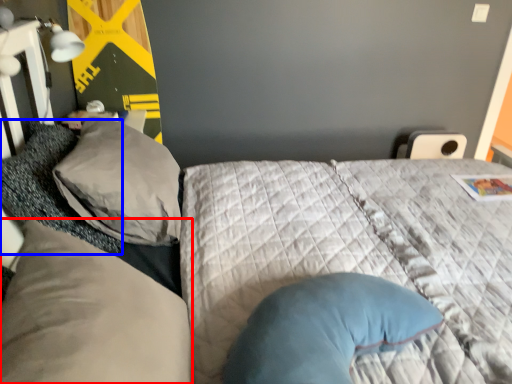
Question: Among these objects, which one is farthest to the camera, pillow (highlighted by a red box) or pillow (highlighted by a blue box)?

Choices:
 (A) pillow
 (B) pillow

Answer: (B)